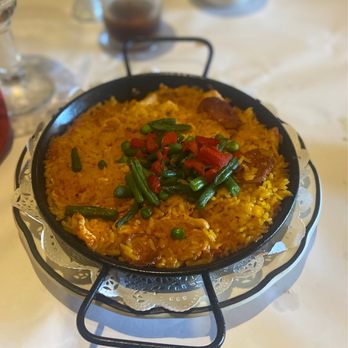
Identify the location of skillet. Image resolution: width=348 pixels, height=348 pixels. (283, 214).